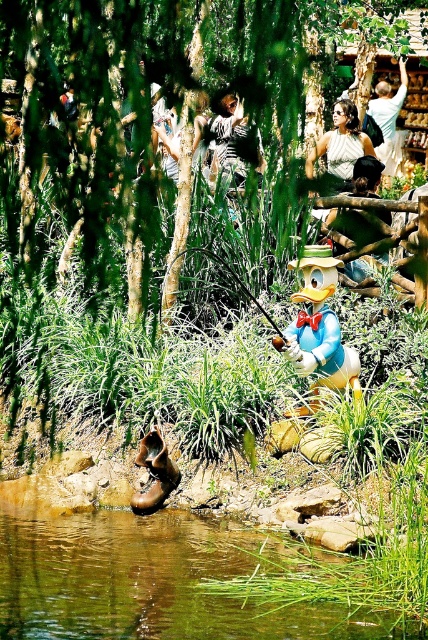
This screenshot has height=640, width=428. Identify the location of green grassy river at lower center. (158, 580).

Can you confirm if green grassy river at lower center is bigger than matte yellow duck at center?

Yes.

Describe the element at coordinates (158, 580) in the screenshot. I see `green grassy river at lower center` at that location.

The height and width of the screenshot is (640, 428). I want to click on green grassy river at lower center, so click(158, 580).

Can you confirm if matte yellow duck at center is positioned to the right of white cotton shirt at upper center?

No, matte yellow duck at center is not to the right of white cotton shirt at upper center.

Is matte yellow duck at center smaller than white cotton shirt at upper center?

Yes, matte yellow duck at center is smaller than white cotton shirt at upper center.

You are a GUI agent. You are given a task and a screenshot of the screen. Output one action in this format:
    pyautogui.click(x=<x>, y=<y>)
    Task: Click on the matte yellow duck at center
    This screenshot has height=640, width=428.
    Given the screenshot: What is the action you would take?
    318,324

Is point (347, 106) in front of point (213, 161)?

No.

Who is more distant from viewer, (x=368, y=145) or (x=213, y=124)?

The point (x=213, y=124) is more distant.

This screenshot has width=428, height=640. Find the location of `white cotton shirt at upper center`. white cotton shirt at upper center is located at coordinates (341, 141).